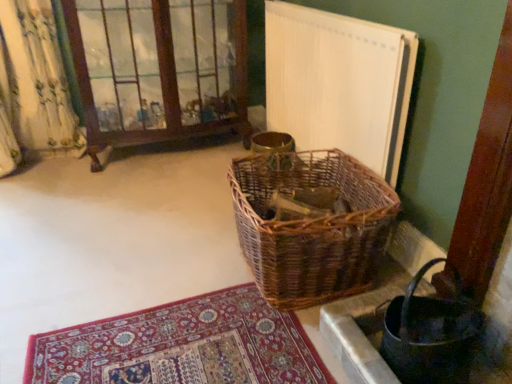
Question: Is white textured radiator at upper right to the right of woven brown picnic basket at center from the viewer's perspective?

Choices:
 (A) yes
 (B) no

Answer: (A)

Question: Considering the relative sizes of white textured radiator at upper right and woven brown picnic basket at center in the image provided, is white textured radiator at upper right bigger than woven brown picnic basket at center?

Choices:
 (A) no
 (B) yes

Answer: (A)

Question: Does white textured radiator at upper right have a lesser width compared to woven brown picnic basket at center?

Choices:
 (A) yes
 (B) no

Answer: (A)

Question: Does white textured radiator at upper right have a lesser height compared to woven brown picnic basket at center?

Choices:
 (A) yes
 (B) no

Answer: (B)

Question: Is white textured radiator at upper right aimed at woven brown picnic basket at center?

Choices:
 (A) yes
 (B) no

Answer: (A)

Question: Based on their sizes in the image, would you say white textured radiator at upper right is bigger or smaller than brown wooden window frame at upper left?

Choices:
 (A) small
 (B) big

Answer: (A)

Question: Would you say white textured radiator at upper right is to the left or to the right of brown wooden window frame at upper left in the picture?

Choices:
 (A) right
 (B) left

Answer: (A)

Question: In terms of height, does white textured radiator at upper right look taller or shorter compared to brown wooden window frame at upper left?

Choices:
 (A) short
 (B) tall

Answer: (A)

Question: In the image, is white textured radiator at upper right positioned in front of or behind brown wooden window frame at upper left?

Choices:
 (A) front
 (B) behind

Answer: (A)

Question: Considering the positions of point (476, 322) and point (320, 238), is point (476, 322) closer or farther from the camera than point (320, 238)?

Choices:
 (A) farther
 (B) closer

Answer: (B)

Question: From a real-world perspective, is woven brown basket at lower right above or below woven brown picnic basket at center?

Choices:
 (A) above
 (B) below

Answer: (B)

Question: Do you think woven brown basket at lower right is within woven brown picnic basket at center, or outside of it?

Choices:
 (A) inside
 (B) outside

Answer: (B)

Question: Is woven brown basket at lower right bigger or smaller than woven brown picnic basket at center?

Choices:
 (A) small
 (B) big

Answer: (A)

Question: Considering the positions of woven brown picnic basket at center and woven brown basket at lower right in the image, is woven brown picnic basket at center taller or shorter than woven brown basket at lower right?

Choices:
 (A) tall
 (B) short

Answer: (A)

Question: Is point (236, 173) closer or farther from the camera than point (415, 273)?

Choices:
 (A) closer
 (B) farther

Answer: (B)